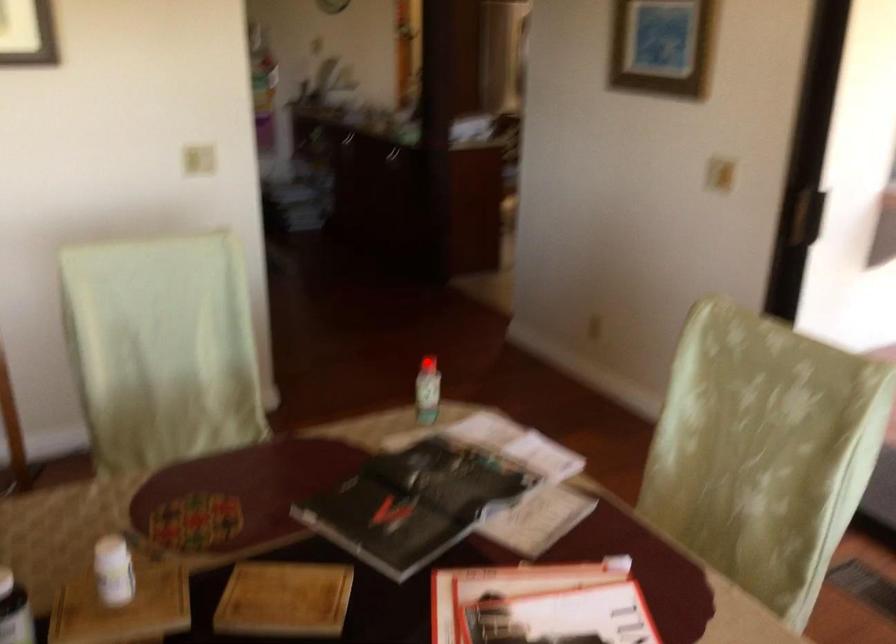
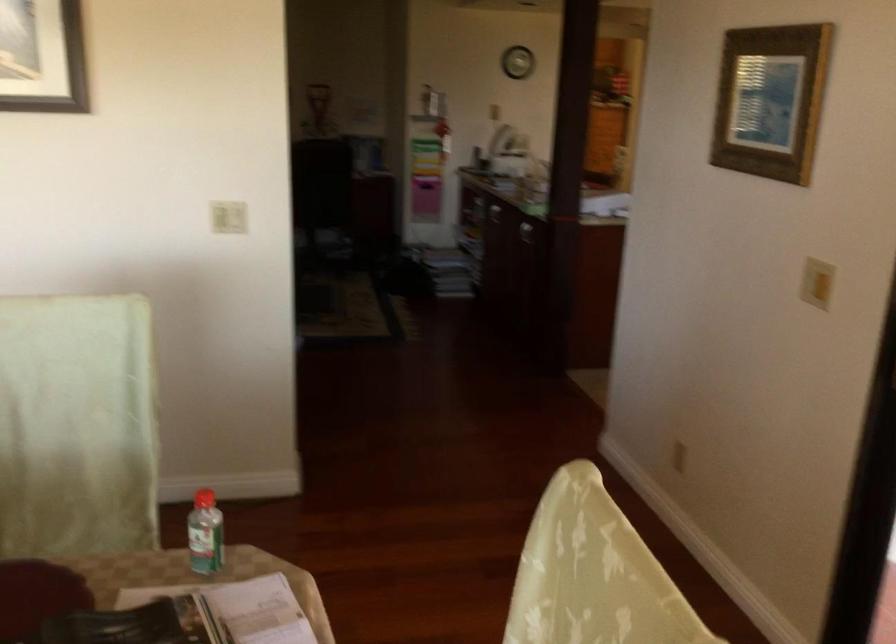
In the second image, find the point that corresponds to the highlighted location in the first image.

(203, 498)